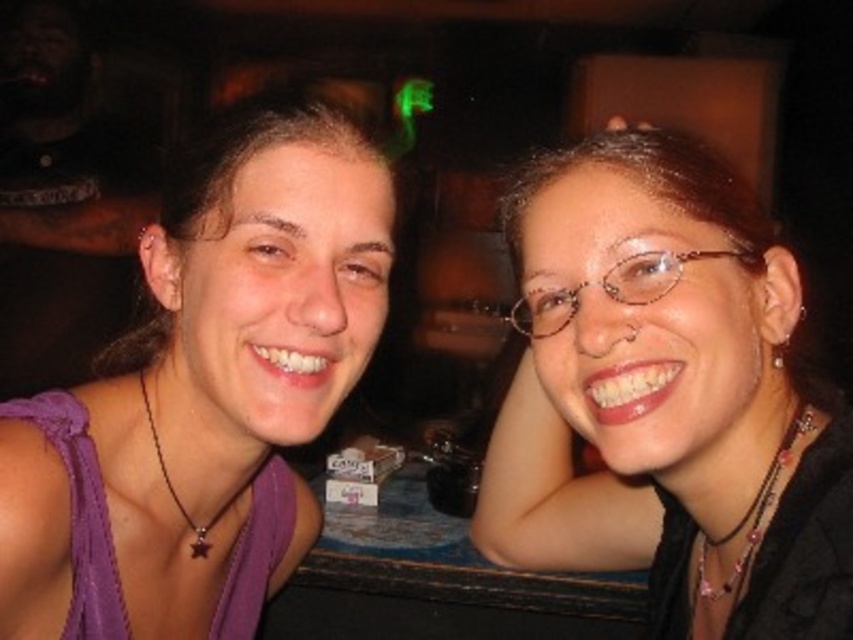
Who is positioned more to the right, purple fabric top at left or clear plastic glasses at upper right?

Positioned to the right is clear plastic glasses at upper right.

Who is more distant from viewer, (268, 120) or (515, 301)?

Point (515, 301)

Does point (85, 564) lie in front of point (648, 273)?

No, (85, 564) is behind (648, 273).

The image size is (853, 640). In order to click on purple fabric top at left in this screenshot , I will do `click(206, 390)`.

Can you confirm if matte black glasses at center is wider than clear plastic glasses at upper right?

Correct, the width of matte black glasses at center exceeds that of clear plastic glasses at upper right.

Does point (819, 448) lie in front of point (651, 276)?

That is False.

This screenshot has height=640, width=853. What are the coordinates of `matte black glasses at center` in the screenshot? It's located at (665, 397).

How far apart are matte black glasses at center and purple fabric top at left?

A distance of 11.18 inches exists between matte black glasses at center and purple fabric top at left.

Consider the image. Is matte black glasses at center wider than purple fabric top at left?

No.

Measure the distance between matte black glasses at center and camera.

matte black glasses at center and camera are 24.66 inches apart.

Find the location of a particular element. The height and width of the screenshot is (640, 853). matte black glasses at center is located at coordinates (665, 397).